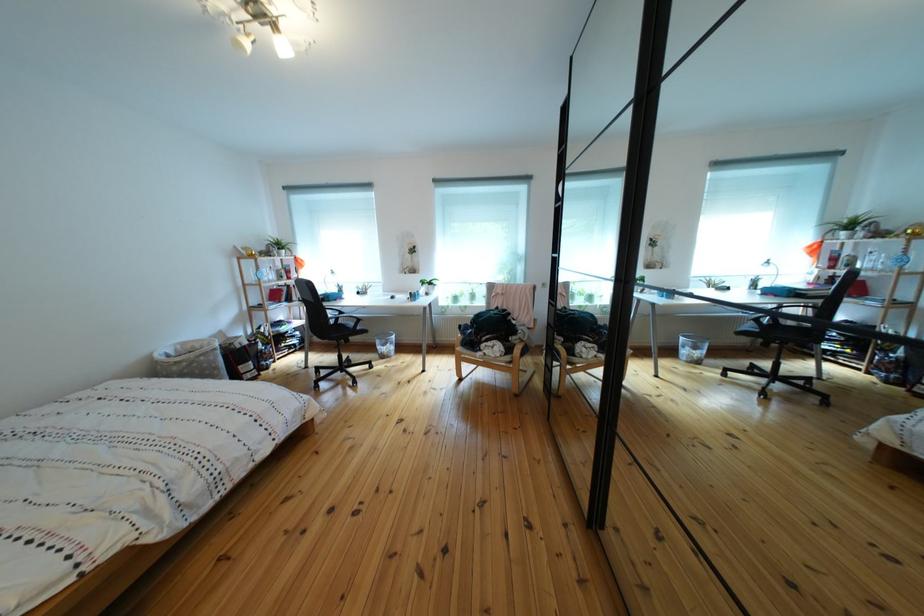
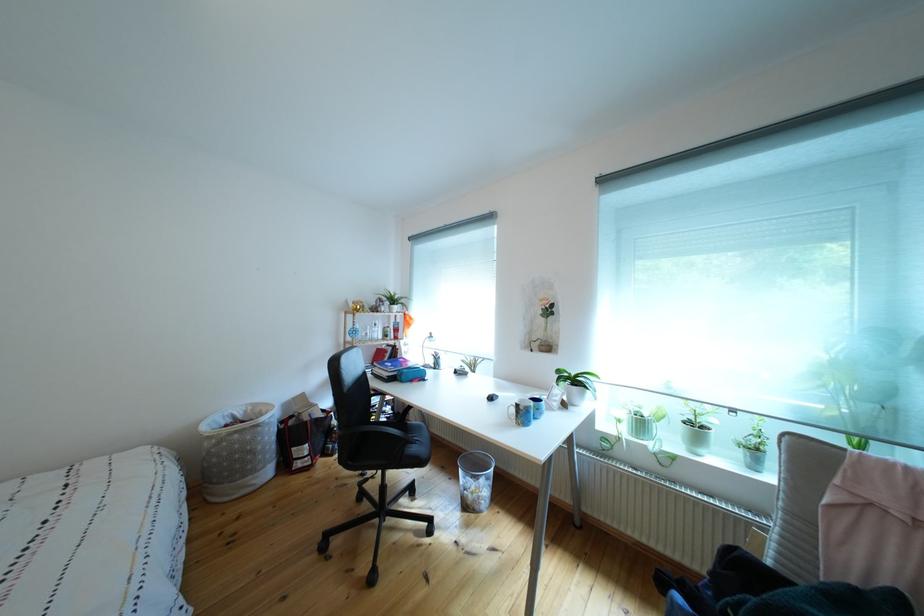
In the second image, find the point that corresponds to point 395,362 in the first image.

(477, 512)